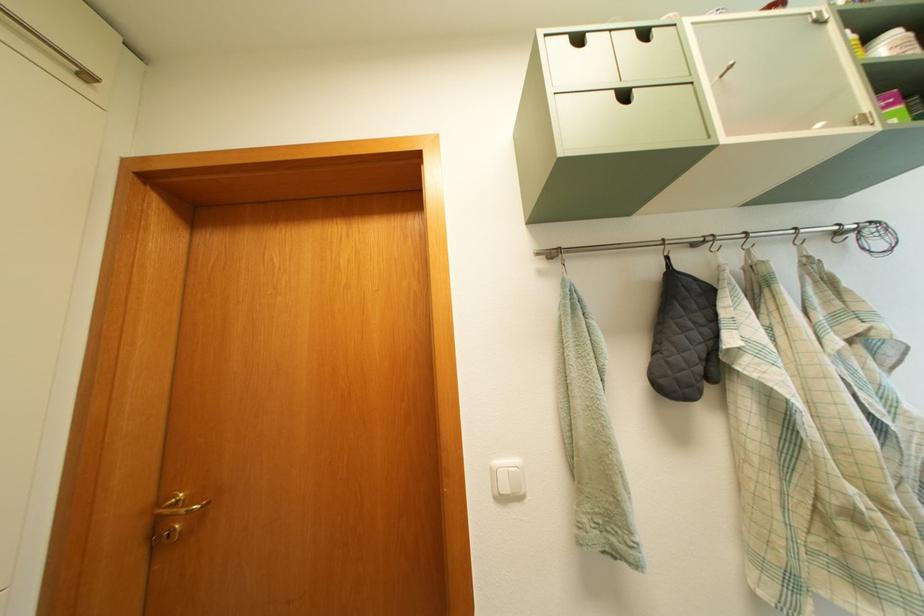
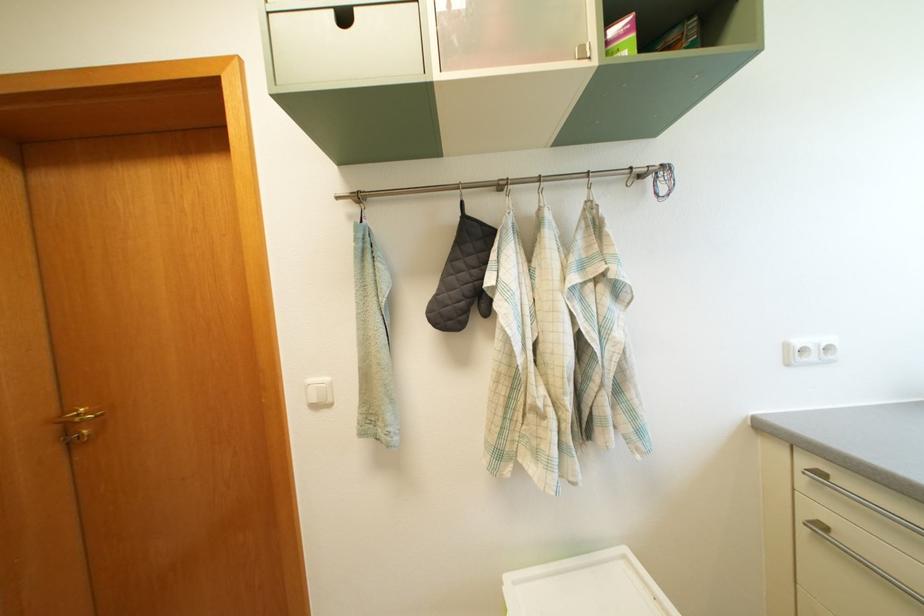
Question: The images are taken continuously from a first-person perspective. In which direction is your viewpoint rotating?

Choices:
 (A) Left
 (B) Right
 (C) Up
 (D) Down

Answer: (D)